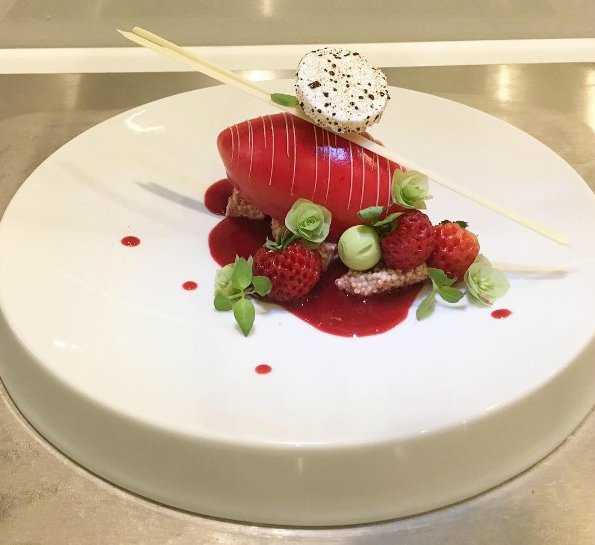
At what (x,y) coordinates should I click in order to perform the action: click on silver counter. Please return your answer as a coordinate pair (x, y). Image resolution: width=595 pixels, height=545 pixels. Looking at the image, I should click on (45, 473), (566, 486), (64, 117), (563, 86), (253, 30).